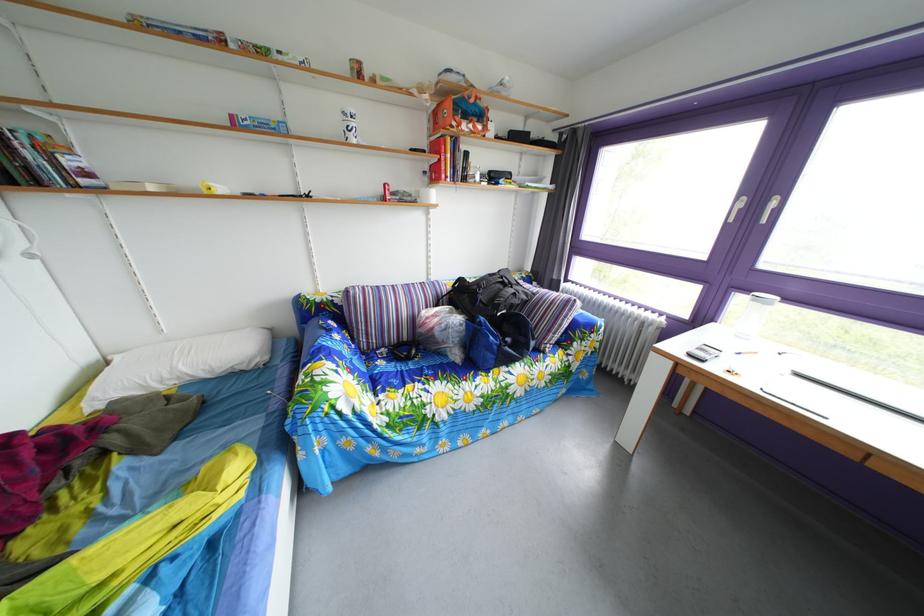
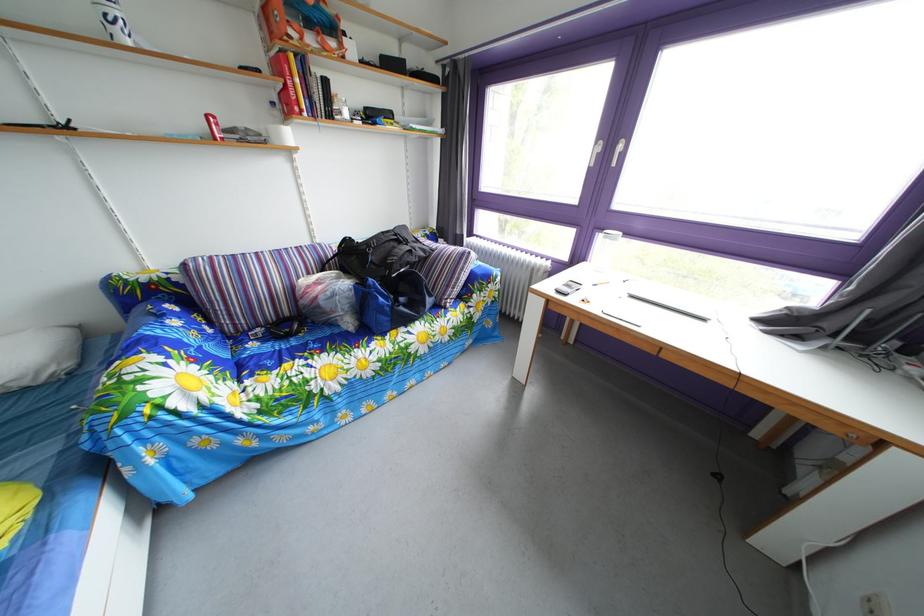
Find the pixel in the second image that matches (723,328) in the first image.

(594, 268)